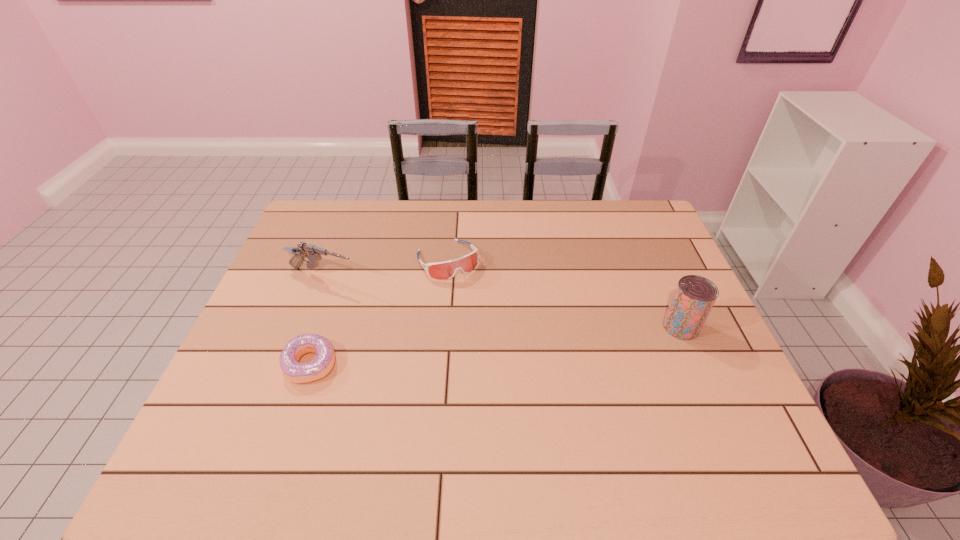
Image resolution: width=960 pixels, height=540 pixels. In order to click on the nearest object in this screenshot , I will do `click(295, 372)`.

The width and height of the screenshot is (960, 540). Identify the location of the shortest object. (295, 372).

Where is `the tallest object`? This screenshot has height=540, width=960. the tallest object is located at coordinates (694, 297).

Locate an element on the screen. the second nearest object is located at coordinates (694, 297).

Identify the location of gun. (313, 253).

This screenshot has height=540, width=960. In order to click on goggles in this screenshot , I will do `click(441, 270)`.

Locate an element on the screen. the third object from left to right is located at coordinates (441, 270).

The width and height of the screenshot is (960, 540). Find the location of `free point located on the left of the shortest object`. free point located on the left of the shortest object is located at coordinates (236, 364).

Where is `vacant region located 0.330m on the left of the second nearest object`? vacant region located 0.330m on the left of the second nearest object is located at coordinates (540, 327).

Find the location of a particular element. The image size is (960, 540). vacant space located 0.330m at the barrel of the third shortest object is located at coordinates (456, 314).